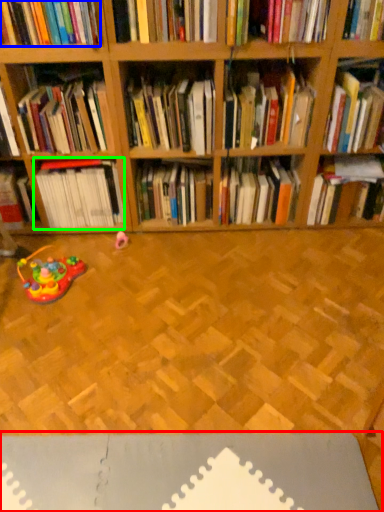
Question: Which object is the closest to the surface (highlighted by a red box)? Choose among these: book (highlighted by a blue box) or book (highlighted by a green box).

Choices:
 (A) book
 (B) book

Answer: (B)